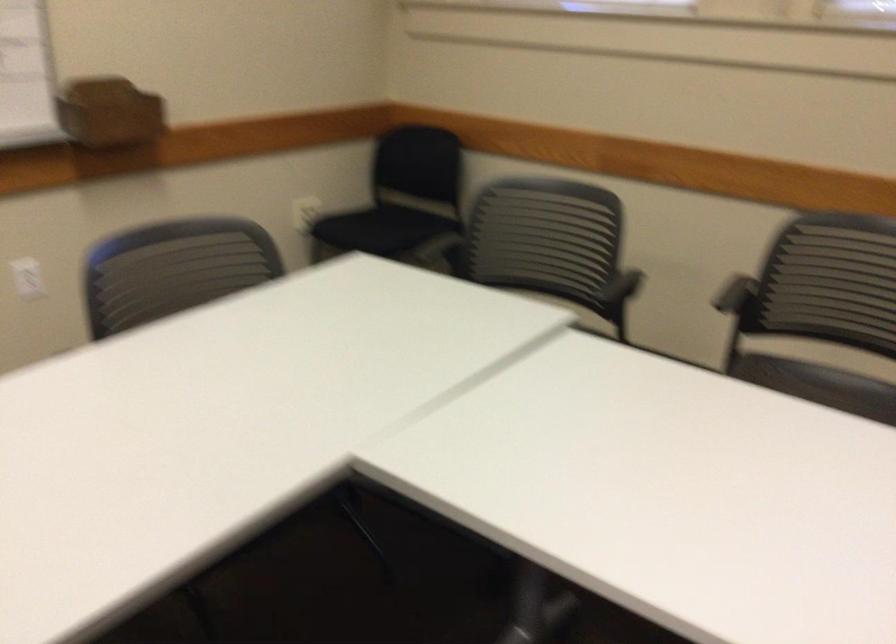
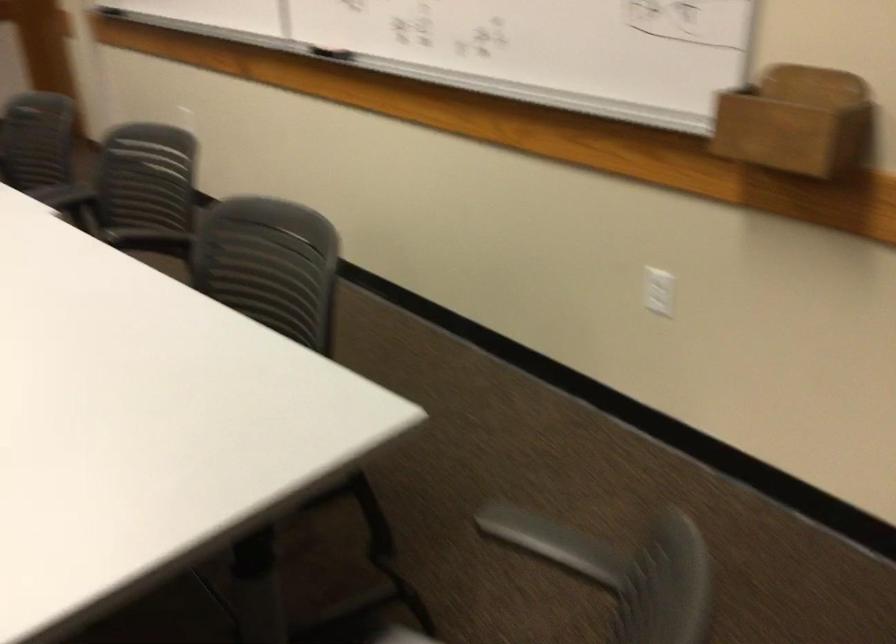
In the second image, find the point that corresponds to point (131, 321) in the first image.

(270, 289)